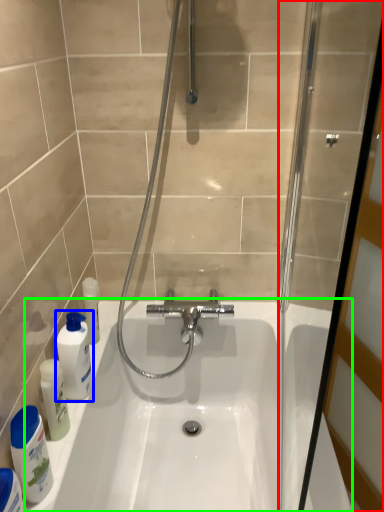
Question: Estimate the real-world distances between objects in this image. Which object is closer to screen door (highlighted by a red box), mouthwash (highlighted by a blue box) or bath (highlighted by a green box)?

Choices:
 (A) mouthwash
 (B) bath

Answer: (B)